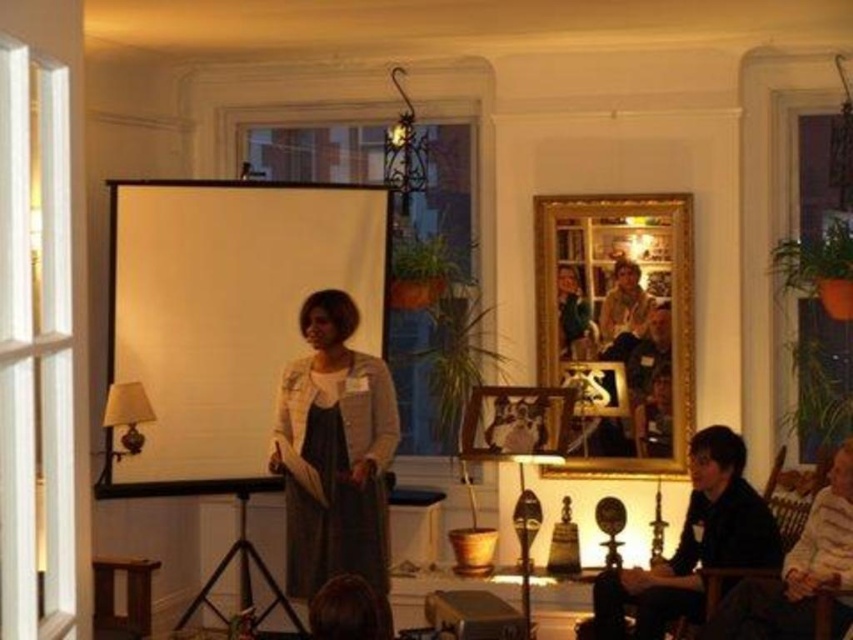
Question: Which point appears farthest from the camera in this image?

Choices:
 (A) (697, 552)
 (B) (381, 522)

Answer: (A)

Question: Which point is closer to the camera?

Choices:
 (A) (306, 433)
 (B) (784, 586)
 (C) (689, 580)

Answer: (B)

Question: Is black matte jacket at lower right wider than dark brown leather jacket at lower right?

Choices:
 (A) no
 (B) yes

Answer: (B)

Question: Does matte gray sweater at center appear on the left side of dark brown leather jacket at lower right?

Choices:
 (A) yes
 (B) no

Answer: (A)

Question: Which object is farther from the camera taking this photo?

Choices:
 (A) black matte jacket at lower right
 (B) dark brown leather jacket at lower right

Answer: (A)

Question: Does black matte jacket at lower right appear on the right side of dark brown leather jacket at lower right?

Choices:
 (A) no
 (B) yes

Answer: (A)